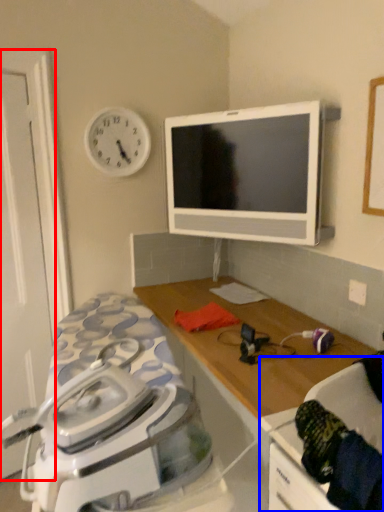
Question: Which point is closer to the camera, door (highlighted by a red box) or swivel chair (highlighted by a blue box)?

Choices:
 (A) door
 (B) swivel chair

Answer: (B)